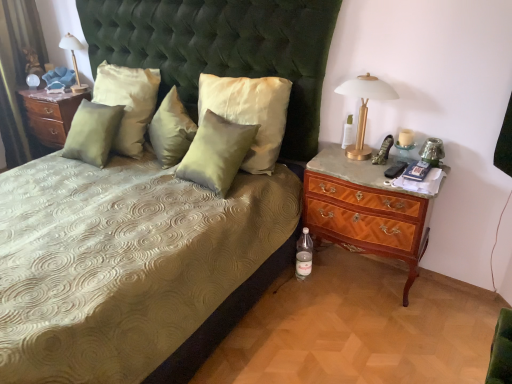
Question: Is satin green pillow at center, positioned as the 1th pillow in left-to-right order, not close to matte wood nightstand at left, positioned as the first nightstand in back-to-front order?

Choices:
 (A) yes
 (B) no

Answer: (B)

Question: From a real-world perspective, is satin green pillow at center, which appears as the fifth pillow when viewed from the right, positioned over matte wood nightstand at left, which appears as the second nightstand when ordered from the bottom, based on gravity?

Choices:
 (A) no
 (B) yes

Answer: (B)

Question: Is satin green pillow at center, positioned as the 1th pillow in left-to-right order, looking in the opposite direction of matte wood nightstand at left, positioned as the 2th nightstand in right-to-left order?

Choices:
 (A) yes
 (B) no

Answer: (B)

Question: Is matte wood nightstand at left, positioned as the 2th nightstand in right-to-left order, inside satin green pillow at center, which appears as the fifth pillow when viewed from the right?

Choices:
 (A) no
 (B) yes

Answer: (A)

Question: Does satin green pillow at center, which appears as the fifth pillow when viewed from the right, have a lesser height compared to matte wood nightstand at left, positioned as the first nightstand in back-to-front order?

Choices:
 (A) no
 (B) yes

Answer: (B)

Question: Is satin green pillow at center, which appears as the fifth pillow when viewed from the right, closer to the viewer compared to matte wood nightstand at left, which appears as the second nightstand when ordered from the bottom?

Choices:
 (A) no
 (B) yes

Answer: (B)

Question: Could you tell me if satin green pillow at center, arranged as the second pillow when viewed from the right, is turned towards clear glass bottle at right, marked as the 1th bottle in a top-to-bottom arrangement?

Choices:
 (A) yes
 (B) no

Answer: (B)

Question: Can you confirm if satin green pillow at center, positioned as the fourth pillow in left-to-right order, is positioned to the left of clear glass bottle at right, positioned as the 2th bottle in bottom-to-top order?

Choices:
 (A) yes
 (B) no

Answer: (A)

Question: Is the position of satin green pillow at center, arranged as the second pillow when viewed from the right, more distant than that of clear glass bottle at right, marked as the 1th bottle in a top-to-bottom arrangement?

Choices:
 (A) no
 (B) yes

Answer: (A)

Question: Is satin green pillow at center, arranged as the second pillow when viewed from the right, positioned beyond the bounds of clear glass bottle at right, positioned as the 2th bottle in bottom-to-top order?

Choices:
 (A) yes
 (B) no

Answer: (A)

Question: Are satin green pillow at center, positioned as the fourth pillow in left-to-right order, and clear glass bottle at right, marked as the 1th bottle in a top-to-bottom arrangement, making contact?

Choices:
 (A) no
 (B) yes

Answer: (A)

Question: Is satin green pillow at center, positioned as the fourth pillow in left-to-right order, shorter than clear glass bottle at right, marked as the 1th bottle in a top-to-bottom arrangement?

Choices:
 (A) no
 (B) yes

Answer: (A)

Question: Could you tell me if clear plastic bottle at lower right, the 1th bottle positioned from the left, is facing satin green pillow at center, the 3th pillow positioned from the right?

Choices:
 (A) no
 (B) yes

Answer: (A)